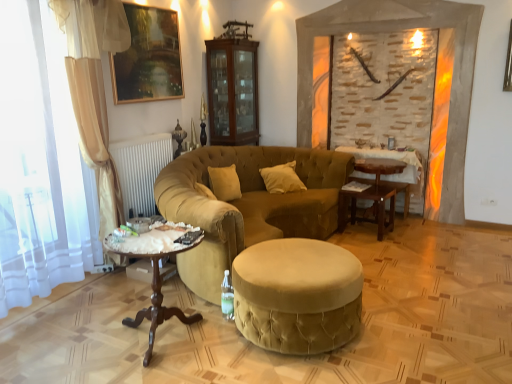
What do you see at coordinates (282, 178) in the screenshot? I see `white velvet pillow at center` at bounding box center [282, 178].

Locate an element on the screen. The width and height of the screenshot is (512, 384). velvet beige stool at center is located at coordinates (297, 295).

You are a GUI agent. You are given a task and a screenshot of the screen. Output one action in this format:
    pyautogui.click(x=<x>, y=<y>)
    Task: Click on the wooden table at center, arranged as the 1th table when viewed from the back
    This screenshot has width=512, height=384.
    Given the screenshot: What is the action you would take?
    pyautogui.click(x=397, y=173)

What do you see at coordinates (39, 162) in the screenshot?
I see `white sheer curtain at left` at bounding box center [39, 162].

Locate an element on the screen. This screenshot has height=384, width=512. white sheer curtain at left is located at coordinates (39, 162).

What do you see at coordinates (248, 205) in the screenshot? This screenshot has width=512, height=384. I see `velvet gold studio couch at center` at bounding box center [248, 205].

Describe the element at coordinates (156, 271) in the screenshot. The width and height of the screenshot is (512, 384). I see `wooden polished table at lower left` at that location.

I want to click on white velvet pillow at center, so click(282, 178).

From their relative heights in the image, would you say white velvet pillow at center is taller or shorter than gold-framed painting at upper center?

Clearly, white velvet pillow at center is shorter compared to gold-framed painting at upper center.

From the image's perspective, which object appears higher, white velvet pillow at center or gold-framed painting at upper center?

gold-framed painting at upper center appears higher in the image.

Considering their positions, is white velvet pillow at center located in front of or behind gold-framed painting at upper center?

white velvet pillow at center is positioned farther from the viewer than gold-framed painting at upper center.

Can you confirm if white velvet pillow at center is positioned to the left of gold-framed painting at upper center?

In fact, white velvet pillow at center is to the right of gold-framed painting at upper center.

Can you confirm if brown wooden cabinet at upper center is bigger than wooden table at center, the 1th table positioned from the front?

Yes.

Locate an element on the screen. the 1st table to the right of the brown wooden cabinet at upper center, counting from the anchor's position is located at coordinates (374, 203).

From a real-world perspective, is brown wooden cabinet at upper center beneath wooden table at center, the 1th table positioned from the front?

No, from a real-world perspective, brown wooden cabinet at upper center is not under wooden table at center, the 1th table positioned from the front.

Would you say wooden table at center, placed as the second table when sorted from back to front, is part of brown wooden cabinet at upper center's contents?

No, brown wooden cabinet at upper center does not contain wooden table at center, placed as the second table when sorted from back to front.

Between brown wooden cabinet at upper center and stone textured fireplace at center, which one has less height?

brown wooden cabinet at upper center is shorter.

From the image's perspective, who appears lower, brown wooden cabinet at upper center or stone textured fireplace at center?

From the image's view, stone textured fireplace at center is below.

Is brown wooden cabinet at upper center oriented towards stone textured fireplace at center?

Yes, brown wooden cabinet at upper center faces towards stone textured fireplace at center.

Is brown wooden cabinet at upper center with stone textured fireplace at center?

No, brown wooden cabinet at upper center is not with stone textured fireplace at center.

Does point (248, 64) come behind point (204, 276)?

Yes.

Can you confirm if brown wooden cabinet at upper center is positioned to the left of velvet gold studio couch at center?

Correct, you'll find brown wooden cabinet at upper center to the left of velvet gold studio couch at center.

Which is in front, brown wooden cabinet at upper center or velvet gold studio couch at center?

velvet gold studio couch at center is more forward.

Does brown wooden cabinet at upper center turn towards velvet gold studio couch at center?

No, brown wooden cabinet at upper center is not aimed at velvet gold studio couch at center.

Is velvet gold studio couch at center far from white sheer curtain at left?

velvet gold studio couch at center is positioned a significant distance from white sheer curtain at left.

Looking at this image, in terms of size, does velvet gold studio couch at center appear bigger or smaller than white sheer curtain at left?

Considering their sizes, velvet gold studio couch at center takes up more space than white sheer curtain at left.

Find the location of a particular element. This screenshot has height=384, width=512. curtain lying on the left of velvet gold studio couch at center is located at coordinates (39, 162).

From the image's perspective, is velvet gold studio couch at center above white sheer curtain at left?

No, from the image's perspective, velvet gold studio couch at center is not on top of white sheer curtain at left.

Which is more to the left, velvet gold studio couch at center or velvet beige stool at center?

From the viewer's perspective, velvet gold studio couch at center appears more on the left side.

Which object is wider, velvet gold studio couch at center or velvet beige stool at center?

velvet gold studio couch at center.

Does velvet gold studio couch at center contain velvet beige stool at center?

Actually, velvet beige stool at center is outside velvet gold studio couch at center.

I want to click on pillow on the left of the velvet beige stool at center, so click(x=282, y=178).

How much distance is there between velvet beige stool at center and white velvet pillow at center?

They are 1.77 meters apart.

Is velvet beige stool at center wider or thinner than white velvet pillow at center?

A: Considering their sizes, velvet beige stool at center looks broader than white velvet pillow at center.

From the image's perspective, is velvet beige stool at center positioned above or below white velvet pillow at center?

velvet beige stool at center is below white velvet pillow at center.

The height and width of the screenshot is (384, 512). I want to click on pillow that appears below the gold-framed painting at upper center (from a real-world perspective), so click(282, 178).

Identify the location of armoire lying above the wooden table at center, placed as the second table when sorted from back to front (from the image's perspective). This screenshot has height=384, width=512. (232, 91).

Consider the image. Considering their positions, is wooden polished table at lower left positioned closer to white sheer curtain at left than stone textured fireplace at center?

wooden polished table at lower left is positioned closer to the anchor white sheer curtain at left.

From the image, which object appears to be nearer to stone textured fireplace at center, wooden polished table at lower left or white velvet pillow at center?

white velvet pillow at center is closer to stone textured fireplace at center.

In the scene shown: Considering their positions, is white velvet pillow at center positioned further to velvet beige stool at center than wooden polished table at lower left?

white velvet pillow at center is positioned further to the anchor velvet beige stool at center.

From the image, which object appears to be nearer to wooden polished table at lower left, white velvet pillow at center or wooden table at center, the 1th table positioned from the front?

white velvet pillow at center lies closer to wooden polished table at lower left than the other object.

From the image, which object appears to be farther from stone textured fireplace at center, gold-framed painting at upper center or velvet beige stool at center?

Answer: Based on the image, velvet beige stool at center appears to be further to stone textured fireplace at center.

When comparing their distances from wooden table at center, placed as the second table when sorted from back to front, does wooden polished table at lower left or wooden table at center, which is counted as the second table, starting from the front, seem further?

wooden polished table at lower left lies further to wooden table at center, placed as the second table when sorted from back to front, than the other object.

When comparing their distances from stone textured fireplace at center, does velvet gold studio couch at center or wooden table at center, placed as the second table when sorted from back to front, seem further?

velvet gold studio couch at center.

Considering their positions, is stone textured fireplace at center positioned further to wooden table at center, placed as the second table when sorted from back to front, than gold-framed painting at upper center?

Based on the image, gold-framed painting at upper center appears to be further to wooden table at center, placed as the second table when sorted from back to front.

This screenshot has width=512, height=384. What are the coordinates of `stool situated between gold-framed painting at upper center and stone textured fireplace at center from left to right` in the screenshot? It's located at [297, 295].

Find the location of `fireplace between velvet gold studio couch at center and wooden table at center, placed as the second table when sorted from back to front, in the front-back direction`. fireplace between velvet gold studio couch at center and wooden table at center, placed as the second table when sorted from back to front, in the front-back direction is located at coordinates (396, 30).

This screenshot has height=384, width=512. In order to click on fireplace between velvet beige stool at center and white velvet pillow at center along the z-axis in this screenshot , I will do `click(396, 30)`.

What are the coordinates of `fireplace between wooden polished table at lower left and white velvet pillow at center along the z-axis` in the screenshot? It's located at click(x=396, y=30).